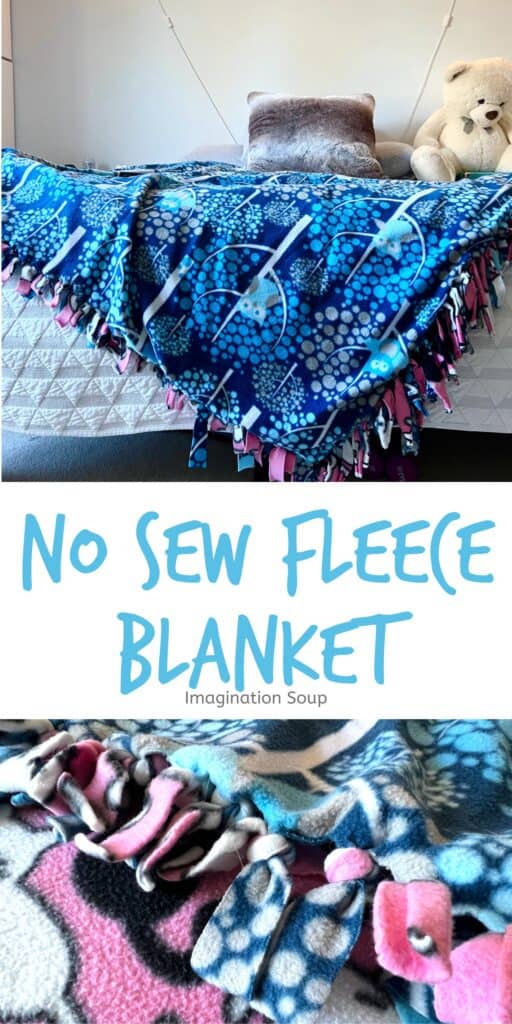
This screenshot has width=512, height=1024. Find the location of `pink fabric`. pink fabric is located at coordinates (115, 965), (176, 924), (476, 971), (424, 919), (158, 817), (277, 458).